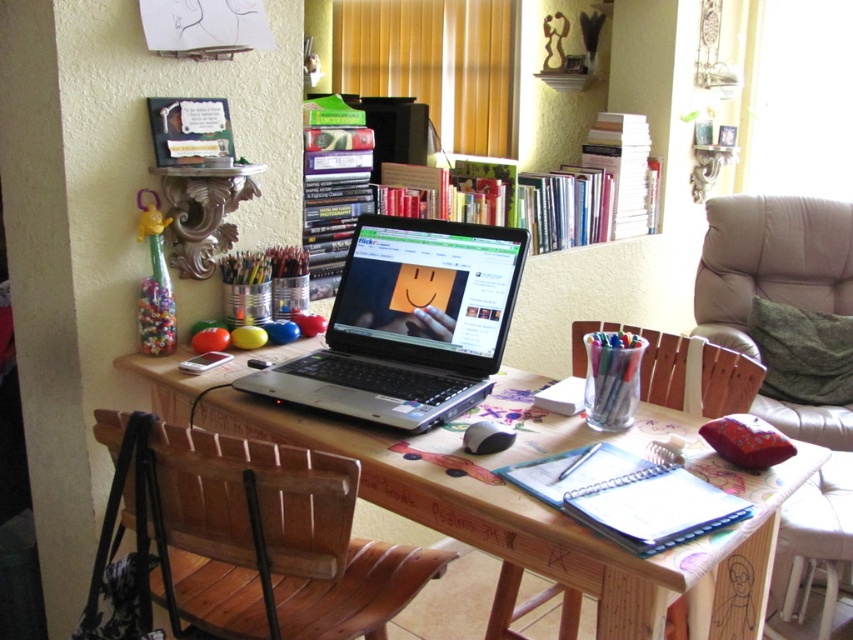
Question: Which point appears closest to the camera in this image?

Choices:
 (A) (387, 493)
 (B) (804, 252)
 (C) (612, 385)

Answer: (A)

Question: Based on their relative distances, which object is nearer to the black plastic mouse at lower center?

Choices:
 (A) wooden armchair at right
 (B) transparent plastic cup at center
 (C) silver/black plastic laptop at center

Answer: (B)

Question: Can you confirm if wooden desk at center is smaller than black plastic mouse at lower center?

Choices:
 (A) yes
 (B) no

Answer: (B)

Question: In this image, where is silver/black plastic laptop at center located relative to wooden armchair at right?

Choices:
 (A) right
 (B) left

Answer: (B)

Question: Is the position of wooden chair at lower left more distant than that of green fabric cushion at right?

Choices:
 (A) yes
 (B) no

Answer: (B)

Question: Which point is farther to the camera?

Choices:
 (A) transparent plastic cup at center
 (B) wooden chair at lower left
 (C) wooden desk at center
 (D) green fabric cushion at right

Answer: (D)